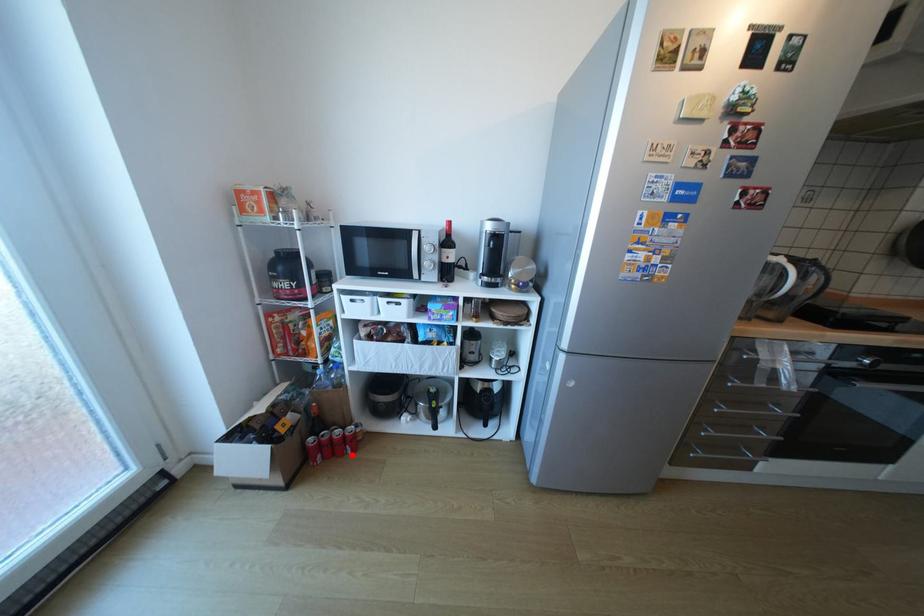
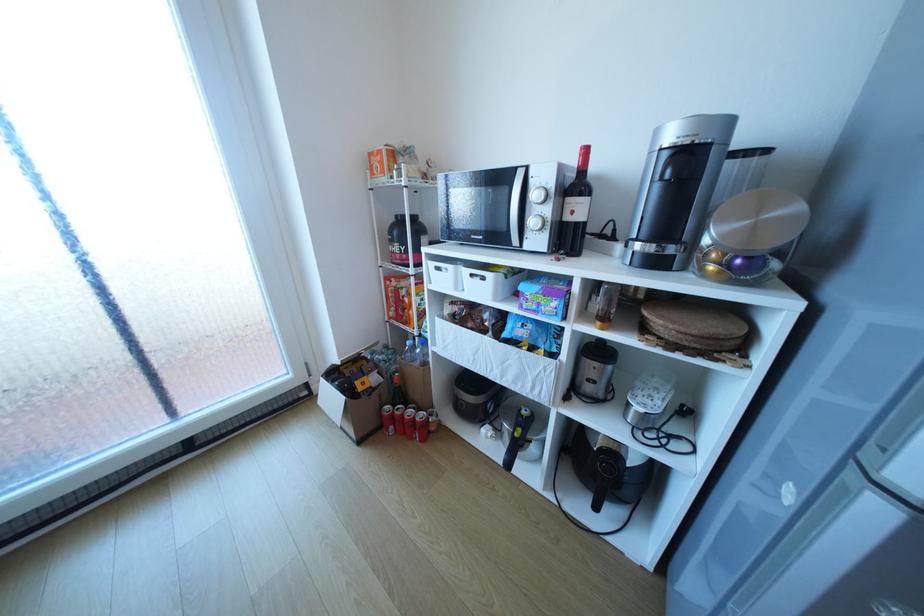
Question: I am providing you with two images of the same scene from different viewpoints. A red point is shown in image1. For the corresponding object point in image2, is it positioned nearer or farther from the camera?

Choices:
 (A) Nearer
 (B) Farther

Answer: (B)